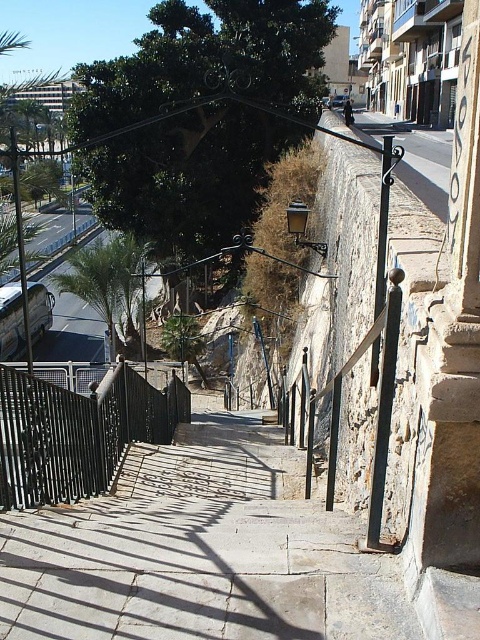
Does point (141, 616) lie in front of point (49, 460)?

Yes.

Between point (3, 636) and point (160, 413), which one is positioned behind?

Point (160, 413)

You are a GUI agent. You are given a task and a screenshot of the screen. Output one action in this format:
    pyautogui.click(x=<x>, y=<y>)
    Task: Click on the smooth stone steps at center
    The width and height of the screenshot is (480, 640).
    Given the screenshot: What is the action you would take?
    pyautogui.click(x=199, y=552)

Is smooth stone steps at center below green leafy palm tree at left?

Correct, smooth stone steps at center is located below green leafy palm tree at left.

Is smooth stone steps at center positioned in front of green leafy palm tree at left?

That is True.

Who is more distant from viewer, (93, 500) or (100, 307)?

The point (100, 307) is more distant.

Where is `smooth stone steps at center`? The image size is (480, 640). smooth stone steps at center is located at coordinates 199,552.

Who is higher up, black wrought iron railing at center or green leafy palm tree at left?

green leafy palm tree at left is higher up.

Consider the image. Does black wrought iron railing at center have a lesser width compared to green leafy palm tree at left?

Indeed, black wrought iron railing at center has a lesser width compared to green leafy palm tree at left.

Between point (166, 403) and point (142, 248), which one is positioned in front?

Point (166, 403) is in front.

Find the location of `black wrought iron railing at center`. black wrought iron railing at center is located at coordinates (78, 432).